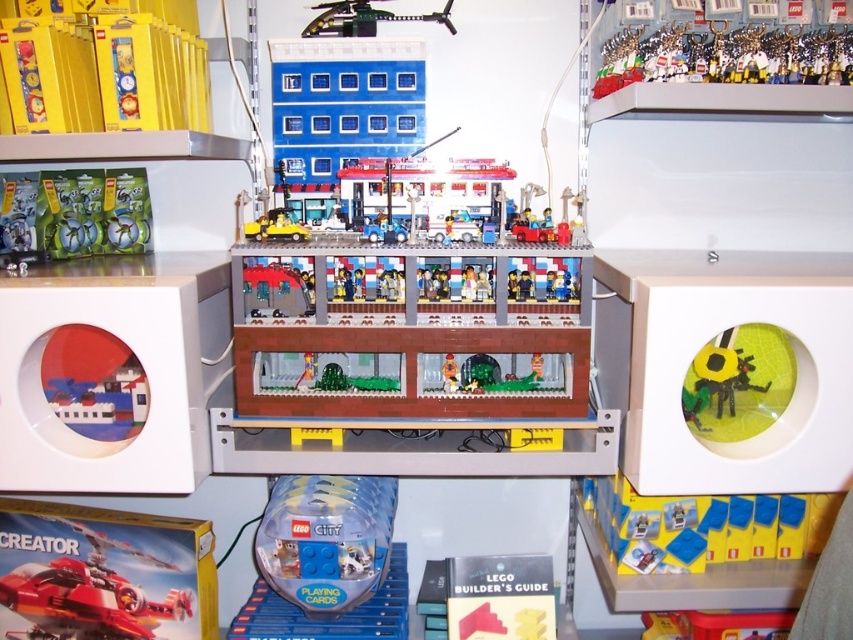
You are a customer in the LEGO store and want to find the shiny red airplane at lower left. Which direction should you look relative to the metallic silver trophy at upper right?

The metallic silver trophy at upper right is located above the shiny red airplane at lower left, so you should look downward from the metallic silver trophy at upper right to find the shiny red airplane at lower left.

You are a customer at the LEGO display and want to take a photo of the yellow matte sunflower at right and the metallic green helicopter at upper center. Which object will appear larger in your photo?

The yellow matte sunflower at right will appear larger in the photo because it is closer to the viewer than the metallic green helicopter at upper center.